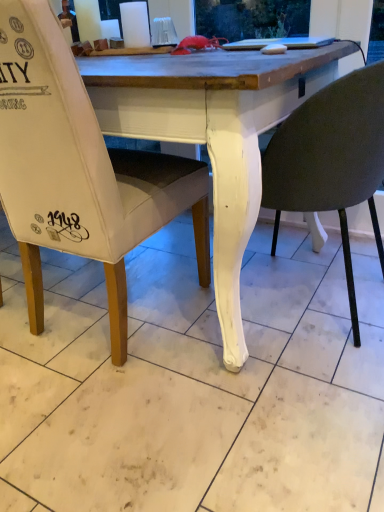
Question: Can you confirm if white matte chair at lower center, marked as the 1th chair in a right-to-left arrangement, is positioned to the left of white fabric chair at left, arranged as the second chair when viewed from the right?

Choices:
 (A) no
 (B) yes

Answer: (A)

Question: Is white matte chair at lower center, which appears as the 2th chair when viewed from the left, bigger than white fabric chair at left, arranged as the second chair when viewed from the right?

Choices:
 (A) no
 (B) yes

Answer: (A)

Question: From a real-world perspective, is white matte chair at lower center, marked as the 1th chair in a right-to-left arrangement, physically above white fabric chair at left, arranged as the second chair when viewed from the right?

Choices:
 (A) yes
 (B) no

Answer: (B)

Question: Could white fabric chair at left, arranged as the second chair when viewed from the right, be considered to be inside white matte chair at lower center, which appears as the 2th chair when viewed from the left?

Choices:
 (A) no
 (B) yes

Answer: (A)

Question: Considering the relative sizes of white matte chair at lower center, which appears as the 2th chair when viewed from the left, and white fabric chair at left, arranged as the second chair when viewed from the right, in the image provided, is white matte chair at lower center, which appears as the 2th chair when viewed from the left, smaller than white fabric chair at left, arranged as the second chair when viewed from the right,?

Choices:
 (A) yes
 (B) no

Answer: (A)

Question: Considering the relative sizes of white matte chair at lower center, which appears as the 2th chair when viewed from the left, and white fabric chair at left, the first chair positioned from the left, in the image provided, is white matte chair at lower center, which appears as the 2th chair when viewed from the left, thinner than white fabric chair at left, the first chair positioned from the left,?

Choices:
 (A) yes
 (B) no

Answer: (A)

Question: Considering the relative positions of white fabric chair at left, the first chair positioned from the left, and white matte chair at lower center, marked as the 1th chair in a right-to-left arrangement, in the image provided, is white fabric chair at left, the first chair positioned from the left, to the right of white matte chair at lower center, marked as the 1th chair in a right-to-left arrangement, from the viewer's perspective?

Choices:
 (A) no
 (B) yes

Answer: (A)

Question: Can you confirm if white fabric chair at left, the first chair positioned from the left, is positioned to the left of white matte chair at lower center, marked as the 1th chair in a right-to-left arrangement?

Choices:
 (A) no
 (B) yes

Answer: (B)

Question: From the image's perspective, is white fabric chair at left, arranged as the second chair when viewed from the right, under white matte chair at lower center, marked as the 1th chair in a right-to-left arrangement?

Choices:
 (A) yes
 (B) no

Answer: (B)

Question: From a real-world perspective, does white fabric chair at left, the first chair positioned from the left, stand above white matte chair at lower center, marked as the 1th chair in a right-to-left arrangement?

Choices:
 (A) no
 (B) yes

Answer: (B)

Question: Is the position of white fabric chair at left, the first chair positioned from the left, more distant than that of white matte chair at lower center, which appears as the 2th chair when viewed from the left?

Choices:
 (A) no
 (B) yes

Answer: (A)

Question: Is the position of white fabric chair at left, the first chair positioned from the left, less distant than that of white matte chair at lower center, which appears as the 2th chair when viewed from the left?

Choices:
 (A) no
 (B) yes

Answer: (B)

Question: Considering the positions of white fabric chair at left, the first chair positioned from the left, and white matte chair at lower center, marked as the 1th chair in a right-to-left arrangement, in the image, is white fabric chair at left, the first chair positioned from the left, wider or thinner than white matte chair at lower center, marked as the 1th chair in a right-to-left arrangement,?

Choices:
 (A) wide
 (B) thin

Answer: (A)